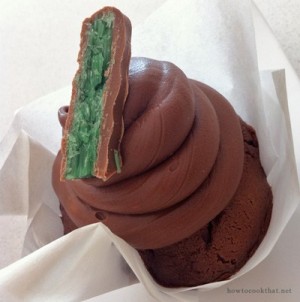
You are a GUI agent. You are given a task and a screenshot of the screen. Output one action in this format:
    pyautogui.click(x=<x>, y=<y>)
    Task: Click on the white napkin
    Image resolution: width=300 pixels, height=302 pixels.
    Given the screenshot: What is the action you would take?
    [x=51, y=149]